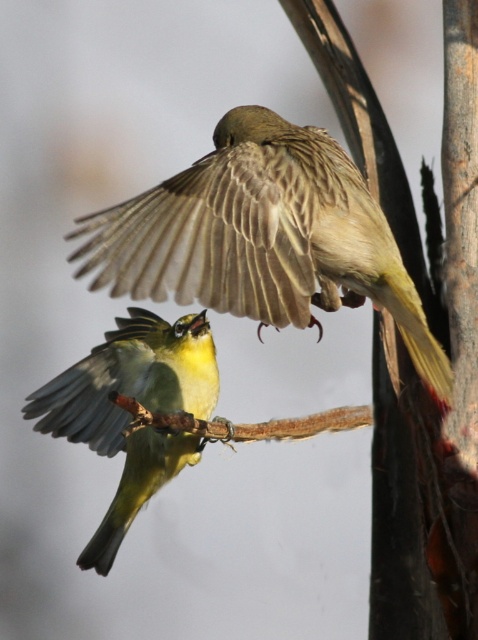
Question: Which point is closer to the camera?

Choices:
 (A) brown textured bird at upper center
 (B) yellow-green feathers at center

Answer: (A)

Question: Can you confirm if brown textured bird at upper center is smaller than yellow-green feathers at center?

Choices:
 (A) no
 (B) yes

Answer: (A)

Question: From the image, what is the correct spatial relationship of brown textured bird at upper center in relation to yellow-green feathers at center?

Choices:
 (A) below
 (B) above

Answer: (B)

Question: Which point is closer to the camera taking this photo?

Choices:
 (A) (295, 310)
 (B) (97, 529)

Answer: (A)

Question: Is brown textured bird at upper center further to camera compared to yellow-green feathers at center?

Choices:
 (A) no
 (B) yes

Answer: (A)